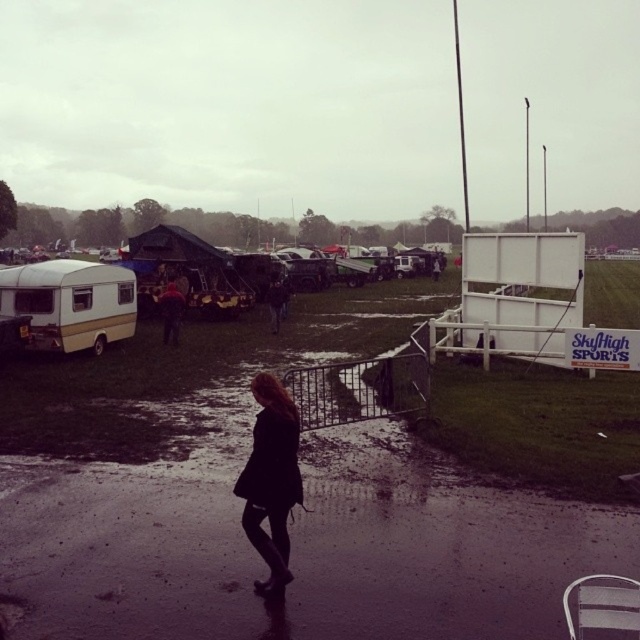
Between gold metallic caravan at left and silhouette fabric dress at center, which one is positioned higher?

Positioned higher is gold metallic caravan at left.

Is gold metallic caravan at left to the left of silhouette fabric dress at center from the viewer's perspective?

Indeed, gold metallic caravan at left is positioned on the left side of silhouette fabric dress at center.

Does point (65, 330) lie in front of point (248, 525)?

No.

Locate an element on the screen. Image resolution: width=640 pixels, height=640 pixels. gold metallic caravan at left is located at coordinates (70, 301).

Can you confirm if gold metallic caravan at left is thinner than dark blue jeans at center?

Incorrect, gold metallic caravan at left's width is not less than dark blue jeans at center's.

Is point (35, 346) in front of point (180, 291)?

Yes.

Between point (20, 310) and point (164, 291), which one is positioned in front?

Point (20, 310) is in front.

Locate an element on the screen. The height and width of the screenshot is (640, 640). gold metallic caravan at left is located at coordinates coord(70,301).

Between point (294, 442) and point (170, 285), which one is positioned behind?

The point (170, 285) is more distant.

Which is in front, point (257, 449) or point (172, 328)?

Positioned in front is point (257, 449).

At what (x,y) coordinates should I click in order to perform the action: click on silhouette fabric dress at center. Please return your answer as a coordinate pair (x, y). Image resolution: width=640 pixels, height=640 pixels. Looking at the image, I should click on (269, 480).

Where is `silhouette fabric dress at center`? This screenshot has height=640, width=640. silhouette fabric dress at center is located at coordinates (269, 480).